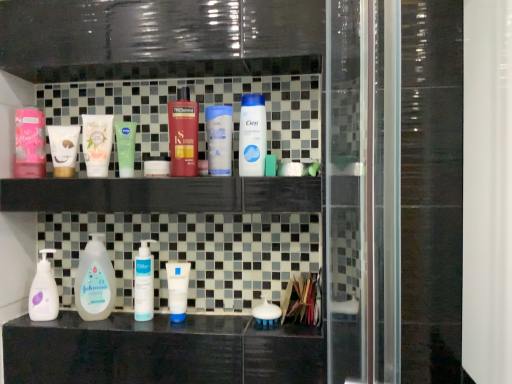
Question: Should I look upward or downward to see matte green tube at center, the first mouthwash in the top-to-bottom sequence?

Choices:
 (A) down
 (B) up

Answer: (B)

Question: Is white matte pump bottle at center, which is the 3th cleaning product from left to right, not inside white matte pump bottle at lower left, acting as the 5th cleaning product starting from the right?

Choices:
 (A) yes
 (B) no

Answer: (A)

Question: Would you consider white matte pump bottle at center, which is the 3th cleaning product from left to right, to be distant from white matte pump bottle at lower left, acting as the 5th cleaning product starting from the right?

Choices:
 (A) yes
 (B) no

Answer: (B)

Question: Can you confirm if white matte pump bottle at center, which is the third cleaning product from right to left, is smaller than white matte pump bottle at lower left, acting as the 5th cleaning product starting from the right?

Choices:
 (A) yes
 (B) no

Answer: (A)

Question: Is white matte pump bottle at center, which is the third cleaning product from right to left, taller than white matte pump bottle at lower left, the first cleaning product from the left?

Choices:
 (A) no
 (B) yes

Answer: (B)

Question: Can you confirm if white matte pump bottle at center, which is the 3th cleaning product from left to right, is bigger than white matte pump bottle at lower left, the first cleaning product from the left?

Choices:
 (A) yes
 (B) no

Answer: (B)

Question: Is white matte pump bottle at center, which is the third cleaning product from right to left, touching white matte pump bottle at lower left, the first cleaning product from the left?

Choices:
 (A) no
 (B) yes

Answer: (A)

Question: From the image's perspective, is white matte tube at center, arranged as the 2th toiletry when viewed from the right, located beneath white matte pump bottle at lower left, the first cleaning product from the left?

Choices:
 (A) yes
 (B) no

Answer: (B)

Question: Is white matte tube at center, arranged as the 4th toiletry when ordered from the bottom, taller than white matte pump bottle at lower left, the first cleaning product from the left?

Choices:
 (A) no
 (B) yes

Answer: (B)

Question: Is white matte tube at center, which ranks as the first toiletry in top-to-bottom order, not near white matte pump bottle at lower left, the first cleaning product from the left?

Choices:
 (A) no
 (B) yes

Answer: (A)

Question: Does white matte tube at center, which ranks as the first toiletry in top-to-bottom order, have a lesser width compared to white matte pump bottle at lower left, acting as the 5th cleaning product starting from the right?

Choices:
 (A) no
 (B) yes

Answer: (A)

Question: Is white matte tube at center, which ranks as the first toiletry in top-to-bottom order, behind white matte pump bottle at lower left, acting as the 5th cleaning product starting from the right?

Choices:
 (A) no
 (B) yes

Answer: (A)

Question: Is white matte tube at center, arranged as the 4th toiletry when ordered from the bottom, positioned before white matte pump bottle at lower left, acting as the 5th cleaning product starting from the right?

Choices:
 (A) yes
 (B) no

Answer: (A)

Question: Does shiny red plastic bottle at center, which appears as the 2th cleaning product when viewed from the right, appear on the left side of white glossy bottle at upper center, the fifth cleaning product viewed from the left?

Choices:
 (A) yes
 (B) no

Answer: (A)